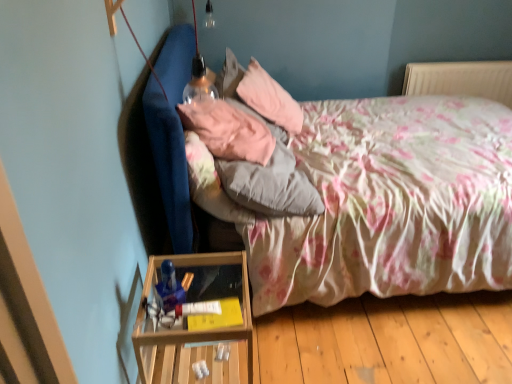
Locate an element on the screen. velvet pink pillow at upper center, the 2th pillow from the front is located at coordinates tap(269, 98).

Which is closer, (x=345, y=191) or (x=274, y=85)?

Point (x=345, y=191) is positioned closer to the camera compared to point (x=274, y=85).

Consider the image. In terms of height, does floral fabric bed at center look taller or shorter compared to velvet pink pillow at upper center, the first pillow when ordered from back to front?

floral fabric bed at center is taller than velvet pink pillow at upper center, the first pillow when ordered from back to front.

Is floral fabric bed at center further to the viewer compared to velvet pink pillow at upper center, the first pillow when ordered from back to front?

That is False.

From a real-world perspective, between floral fabric bed at center and velvet pink pillow at upper center, the 2th pillow from the front, who is vertically higher?

velvet pink pillow at upper center, the 2th pillow from the front.

From a real-world perspective, who is located lower, pink fabric pillow at upper center, the second pillow when ordered from back to front, or velvet pink pillow at upper center, the 2th pillow from the front?

velvet pink pillow at upper center, the 2th pillow from the front, from a real-world perspective.

Who is more distant, pink fabric pillow at upper center, the second pillow when ordered from back to front, or velvet pink pillow at upper center, the 2th pillow from the front?

velvet pink pillow at upper center, the 2th pillow from the front, is further from the camera.

Does pink fabric pillow at upper center, acting as the 1th pillow starting from the front, turn towards velvet pink pillow at upper center, the first pillow when ordered from back to front?

No, pink fabric pillow at upper center, acting as the 1th pillow starting from the front, is not turned towards velvet pink pillow at upper center, the first pillow when ordered from back to front.

Does pink fabric pillow at upper center, the second pillow when ordered from back to front, touch velvet pink pillow at upper center, the 2th pillow from the front?

No, pink fabric pillow at upper center, the second pillow when ordered from back to front, is not in contact with velvet pink pillow at upper center, the 2th pillow from the front.

Can you confirm if floral fabric bed at center is thinner than pink fabric pillow at upper center, the second pillow when ordered from back to front?

No.

From the image's perspective, would you say floral fabric bed at center is shown under pink fabric pillow at upper center, acting as the 1th pillow starting from the front?

Yes, from the image's perspective, floral fabric bed at center is beneath pink fabric pillow at upper center, acting as the 1th pillow starting from the front.

Between floral fabric bed at center and pink fabric pillow at upper center, the second pillow when ordered from back to front, which one appears on the right side from the viewer's perspective?

Positioned to the right is floral fabric bed at center.

From the image's perspective, does velvet pink pillow at upper center, the 2th pillow from the front, appear higher than floral fabric bed at center?

Yes, from the image's perspective, velvet pink pillow at upper center, the 2th pillow from the front, is above floral fabric bed at center.

Locate an element on the screen. pillow that is the 1st one above the floral fabric bed at center (from a real-world perspective) is located at coordinates (269, 98).

Based on the photo, does velvet pink pillow at upper center, the 2th pillow from the front, have a greater height compared to floral fabric bed at center?

In fact, velvet pink pillow at upper center, the 2th pillow from the front, may be shorter than floral fabric bed at center.

Which object is thinner, velvet pink pillow at upper center, the 2th pillow from the front, or floral fabric bed at center?

With smaller width is velvet pink pillow at upper center, the 2th pillow from the front.

From the image's perspective, between velvet pink pillow at upper center, the 2th pillow from the front, and pink fabric pillow at upper center, the second pillow when ordered from back to front, which one is located above?

velvet pink pillow at upper center, the 2th pillow from the front.

Who is bigger, velvet pink pillow at upper center, the 2th pillow from the front, or pink fabric pillow at upper center, the second pillow when ordered from back to front?

Bigger between the two is velvet pink pillow at upper center, the 2th pillow from the front.

Which object is thinner, velvet pink pillow at upper center, the 2th pillow from the front, or pink fabric pillow at upper center, acting as the 1th pillow starting from the front?

pink fabric pillow at upper center, acting as the 1th pillow starting from the front, is thinner.

From a real-world perspective, does velvet pink pillow at upper center, the 2th pillow from the front, stand above pink fabric pillow at upper center, the second pillow when ordered from back to front?

No.

Where is `bed in front of the pink fabric pillow at upper center, acting as the 1th pillow starting from the front`? Image resolution: width=512 pixels, height=384 pixels. bed in front of the pink fabric pillow at upper center, acting as the 1th pillow starting from the front is located at coordinates (383, 202).

From a real-world perspective, which is physically below, pink fabric pillow at upper center, acting as the 1th pillow starting from the front, or floral fabric bed at center?

floral fabric bed at center.

Is pink fabric pillow at upper center, the second pillow when ordered from back to front, with floral fabric bed at center?

pink fabric pillow at upper center, the second pillow when ordered from back to front, and floral fabric bed at center are clearly separated.

Considering the relative sizes of pink fabric pillow at upper center, the second pillow when ordered from back to front, and floral fabric bed at center in the image provided, is pink fabric pillow at upper center, the second pillow when ordered from back to front, bigger than floral fabric bed at center?

Incorrect, pink fabric pillow at upper center, the second pillow when ordered from back to front, is not larger than floral fabric bed at center.

Where is `bed on the right side of velvet pink pillow at upper center, the 2th pillow from the front`? This screenshot has width=512, height=384. bed on the right side of velvet pink pillow at upper center, the 2th pillow from the front is located at coordinates (383, 202).

What are the coordinates of `pillow above the pink fabric pillow at upper center, the second pillow when ordered from back to front (from the image's perspective)` in the screenshot? It's located at (269, 98).

Considering their positions, is velvet pink pillow at upper center, the first pillow when ordered from back to front, positioned closer to floral fabric bed at center than pink fabric pillow at upper center, acting as the 1th pillow starting from the front?

The object closer to floral fabric bed at center is pink fabric pillow at upper center, acting as the 1th pillow starting from the front.

Estimate the real-world distances between objects in this image. Which object is further from velvet pink pillow at upper center, the 2th pillow from the front, floral fabric bed at center or pink fabric pillow at upper center, acting as the 1th pillow starting from the front?

floral fabric bed at center lies further to velvet pink pillow at upper center, the 2th pillow from the front, than the other object.

From the image, which object appears to be farther from floral fabric bed at center, pink fabric pillow at upper center, the second pillow when ordered from back to front, or velvet pink pillow at upper center, the 2th pillow from the front?

Among the two, velvet pink pillow at upper center, the 2th pillow from the front, is located further to floral fabric bed at center.

Based on their spatial positions, is floral fabric bed at center or velvet pink pillow at upper center, the 2th pillow from the front, closer to pink fabric pillow at upper center, acting as the 1th pillow starting from the front?

Among the two, velvet pink pillow at upper center, the 2th pillow from the front, is located nearer to pink fabric pillow at upper center, acting as the 1th pillow starting from the front.

Estimate the real-world distances between objects in this image. Which object is further from pink fabric pillow at upper center, acting as the 1th pillow starting from the front, velvet pink pillow at upper center, the 2th pillow from the front, or floral fabric bed at center?

floral fabric bed at center is further to pink fabric pillow at upper center, acting as the 1th pillow starting from the front.

From the image, which object appears to be nearer to velvet pink pillow at upper center, the 2th pillow from the front, pink fabric pillow at upper center, the second pillow when ordered from back to front, or floral fabric bed at center?

pink fabric pillow at upper center, the second pillow when ordered from back to front, is closer to velvet pink pillow at upper center, the 2th pillow from the front.

Locate an element on the screen. The width and height of the screenshot is (512, 384). pillow between floral fabric bed at center and velvet pink pillow at upper center, the first pillow when ordered from back to front, from front to back is located at coordinates coord(228,130).